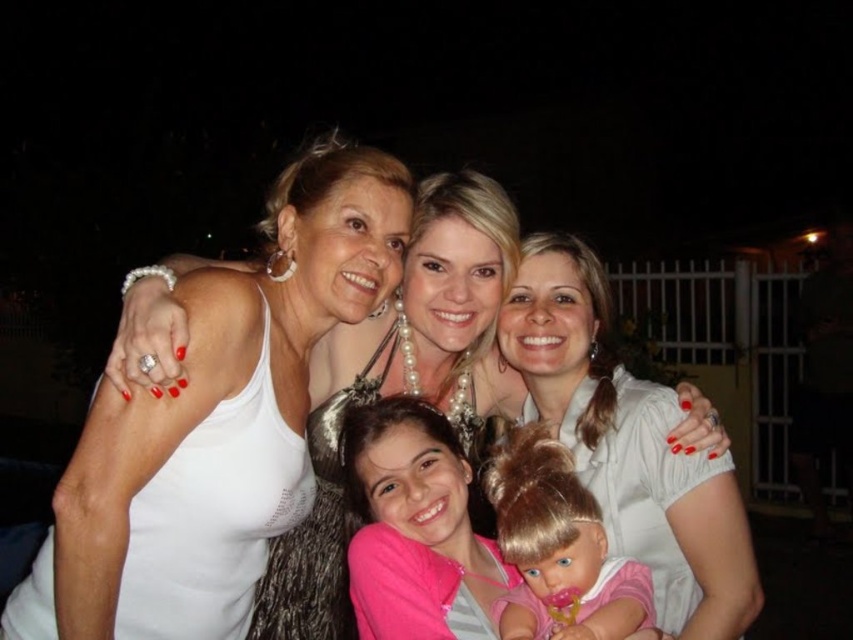
You are a photographer who needs to adjust the lighting to highlight both the white pearl necklace at center and the white satin blouse at center. Since the necklace is larger than the blouse, which object should you focus on to ensure proper exposure?

The white pearl necklace at center has a larger size compared to the white satin blouse at center, so you should focus on the necklace to ensure proper exposure because its larger size requires more light to capture details effectively.

You are standing at the point with coordinates point (380, 483) and want to move to the point with coordinates point (561, 435). Is the point you want to reach behind you?

Yes, the point (561, 435) is behind point (380, 483), so the point you want to reach is behind you.

You are a photographer reviewing this nighttime group photo. You notice two white items at the center of the image. Which one is taller between the white pearl necklace at center and the white satin blouse at center?

The white pearl necklace at center is taller than the white satin blouse at center according to the description.